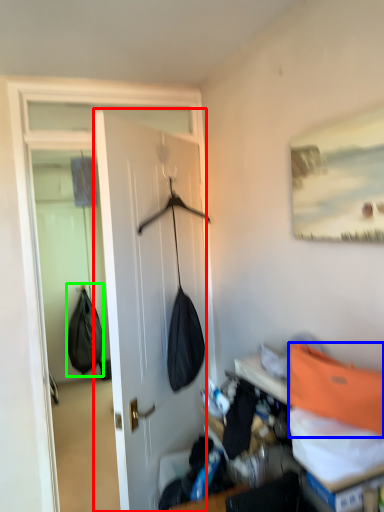
Question: Considering the real-world distances, which object is farthest from door (highlighted by a red box)? shoulder bag (highlighted by a blue box) or shoulder bag (highlighted by a green box)?

Choices:
 (A) shoulder bag
 (B) shoulder bag

Answer: (B)